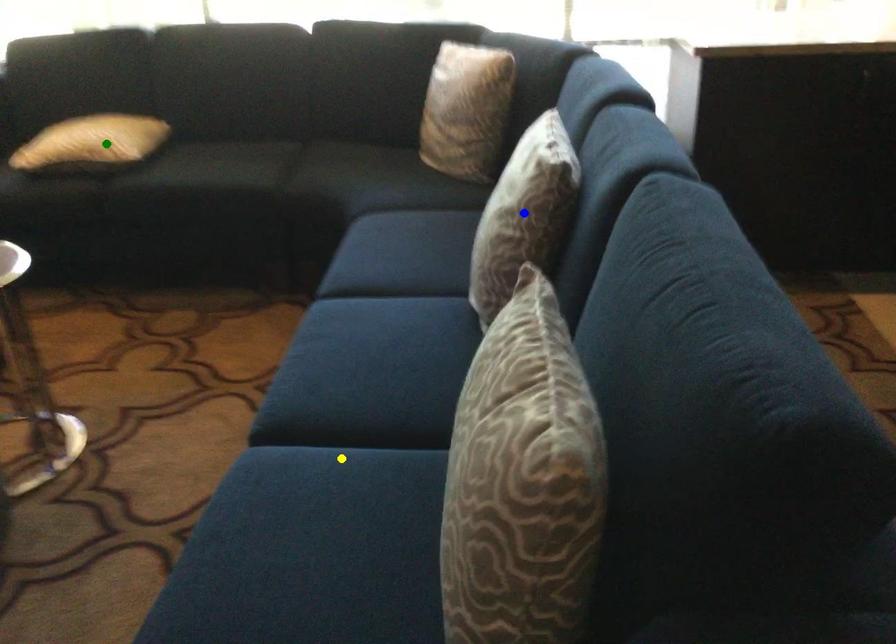
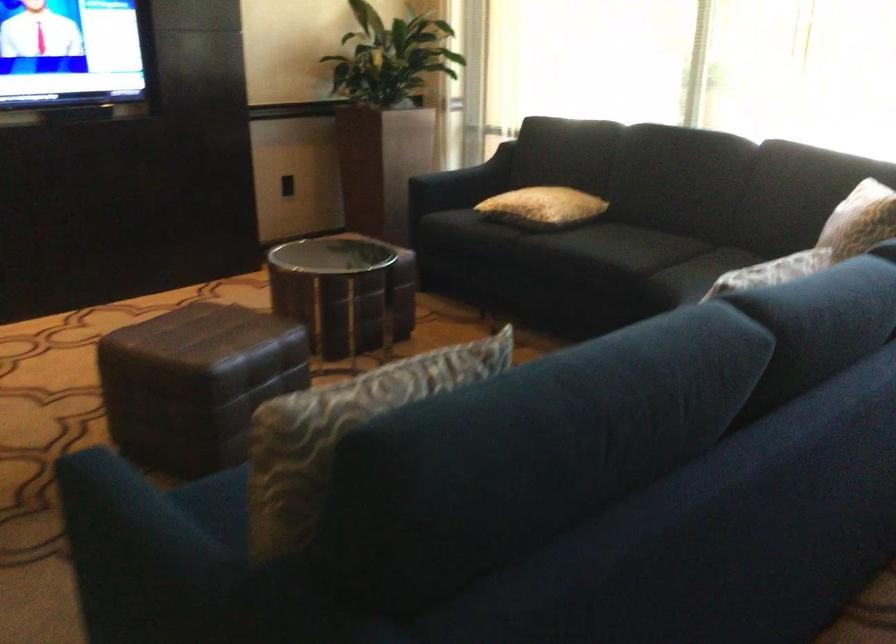
I am providing you with two images of the same scene from different viewpoints. Three points are marked in image1. Which point corresponds to a part or object that is occluded in image2?In image1, three points are marked. Which of them correspond to a part or object that is occluded in image2?Among the three points shown in image1, which one corresponds to a part or object that is no longer visible due to occlusion in image2?

yellow point, blue point